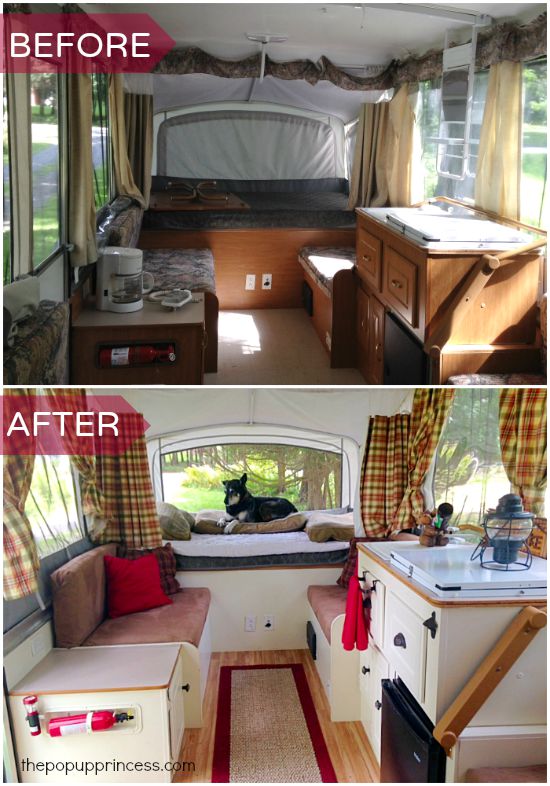
At what (x,y) coordinates should I click in order to perform the action: click on chair. Please return your answer as a coordinate pair (x, y). The height and width of the screenshot is (786, 550). Looking at the image, I should click on (148, 619).